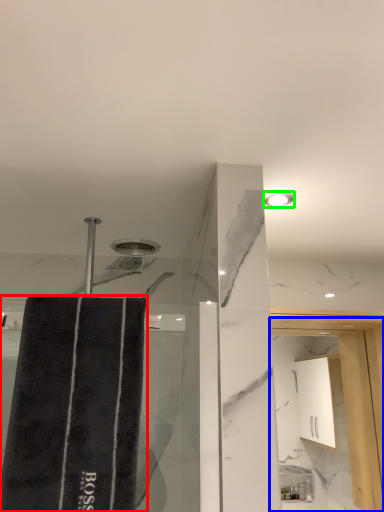
Question: Considering the real-world distances, which object is farthest from bath towel (highlighted by a red box)? screen door (highlighted by a blue box) or light fixture (highlighted by a green box)?

Choices:
 (A) screen door
 (B) light fixture

Answer: (A)